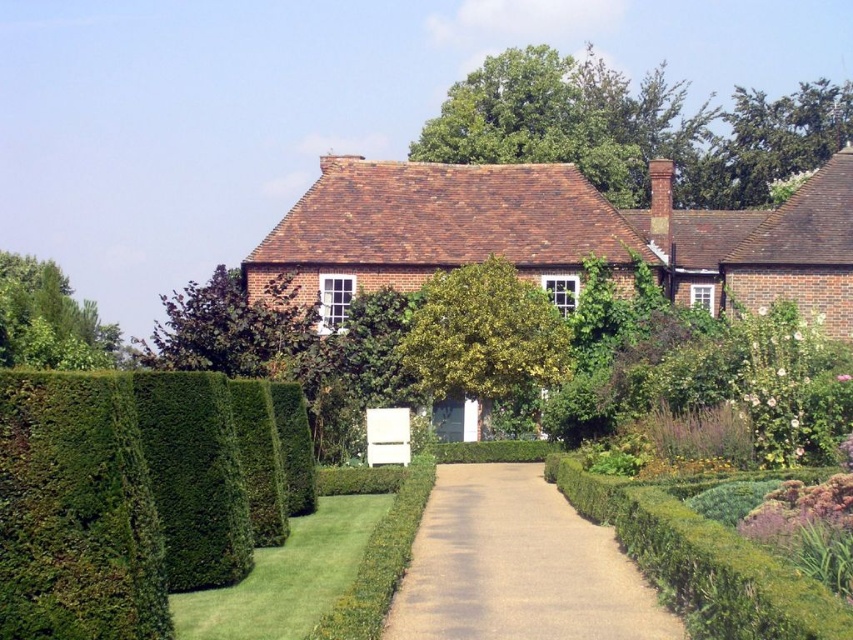
This screenshot has height=640, width=853. Describe the element at coordinates (634, 129) in the screenshot. I see `green leafy tree at upper center` at that location.

Does green leafy tree at upper center have a greater height compared to brown gravel driveway at center?

Indeed, green leafy tree at upper center has a greater height compared to brown gravel driveway at center.

Locate an element on the screen. This screenshot has height=640, width=853. green leafy tree at upper center is located at coordinates (634, 129).

Which is more to the right, green leafy tree at upper center or green leafy tree at center?

green leafy tree at upper center

At what (x,y) coordinates should I click in order to perform the action: click on green leafy tree at upper center. Please return your answer as a coordinate pair (x, y). The image size is (853, 640). Looking at the image, I should click on (634, 129).

Find the location of `green leafy tree at upper center`. green leafy tree at upper center is located at coordinates (634, 129).

Image resolution: width=853 pixels, height=640 pixels. In order to click on green leafy tree at upper center in this screenshot , I will do `click(634, 129)`.

Does green leafy tree at upper center appear under purple leafy tree at center?

No.

Is green leafy tree at upper center bigger than purple leafy tree at center?

Indeed, green leafy tree at upper center has a larger size compared to purple leafy tree at center.

Does point (750, 92) lie in front of point (281, 291)?

No, it is not.

You are a GUI agent. You are given a task and a screenshot of the screen. Output one action in this format:
    pyautogui.click(x=<x>, y=<y>)
    Task: Click on the green leafy tree at upper center
    
    Given the screenshot: What is the action you would take?
    pyautogui.click(x=634, y=129)